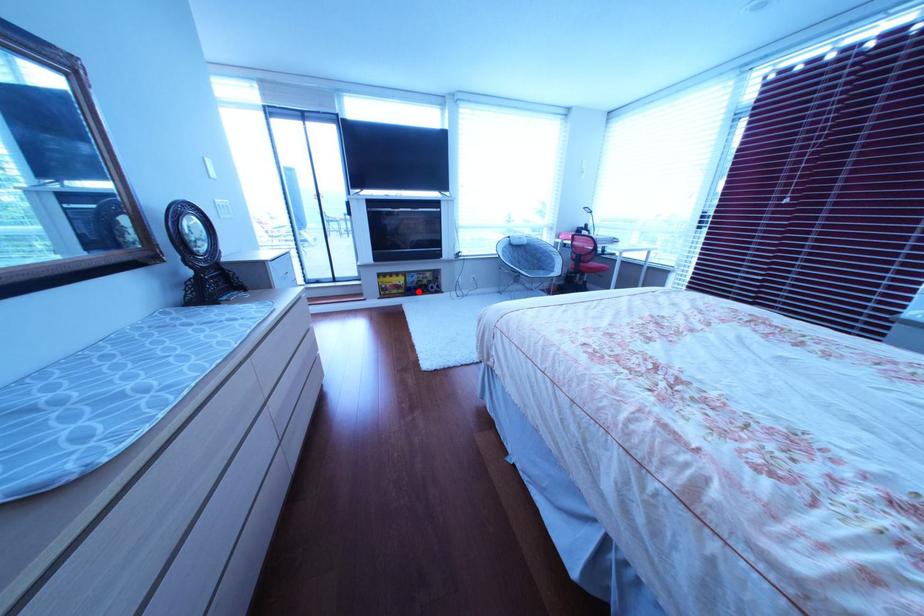
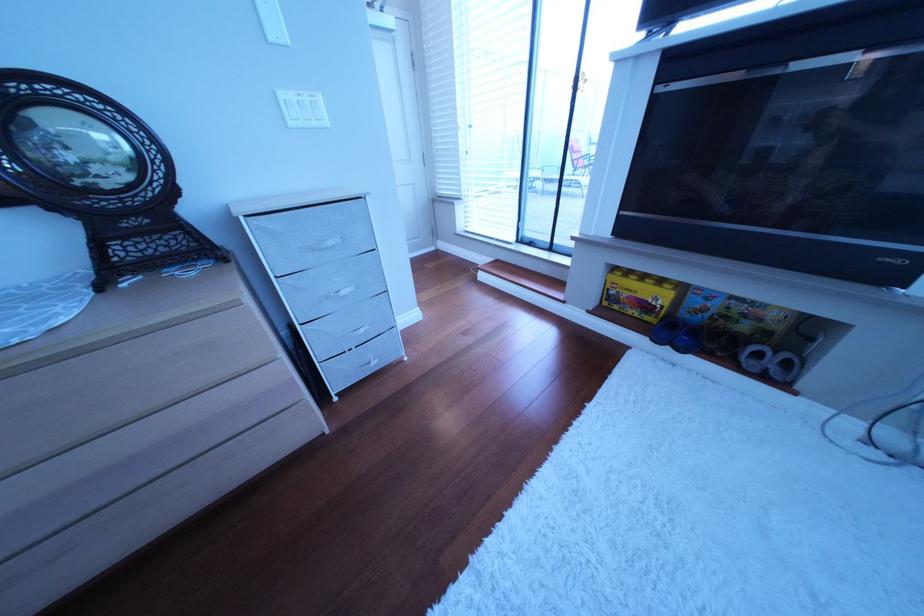
Question: I am providing you with two images of the same scene from different viewpoints. A red point is shown in image1. For the corresponding object point in image2, is it positioned nearer or farther from the camera?

Choices:
 (A) Nearer
 (B) Farther

Answer: (A)